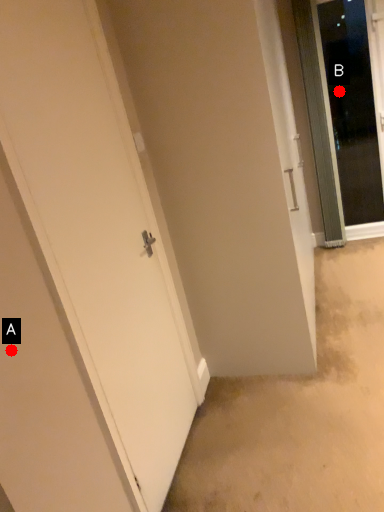
Question: Two points are circled on the image, labeled by A and B beside each circle. Which point is farther to the camera?

Choices:
 (A) A is further
 (B) B is further

Answer: (B)